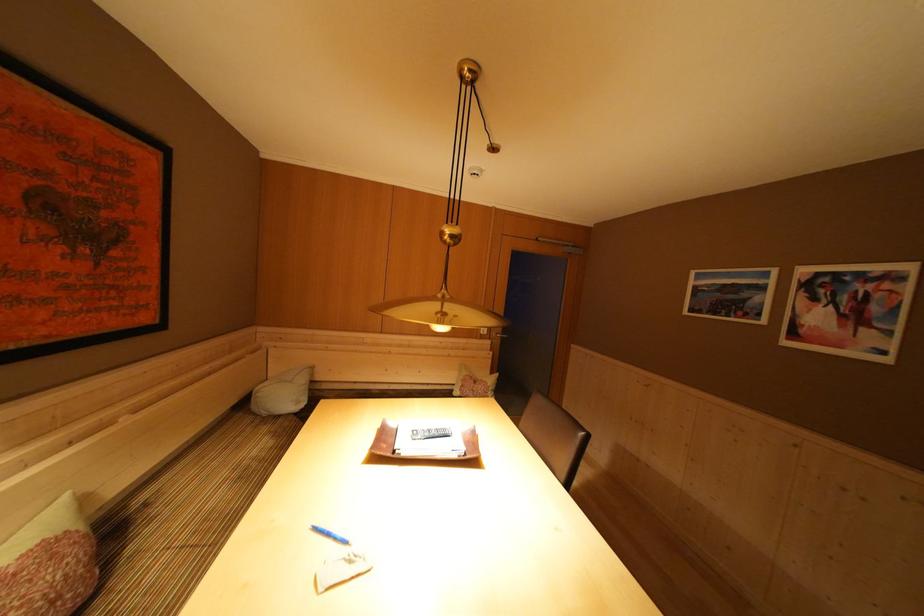
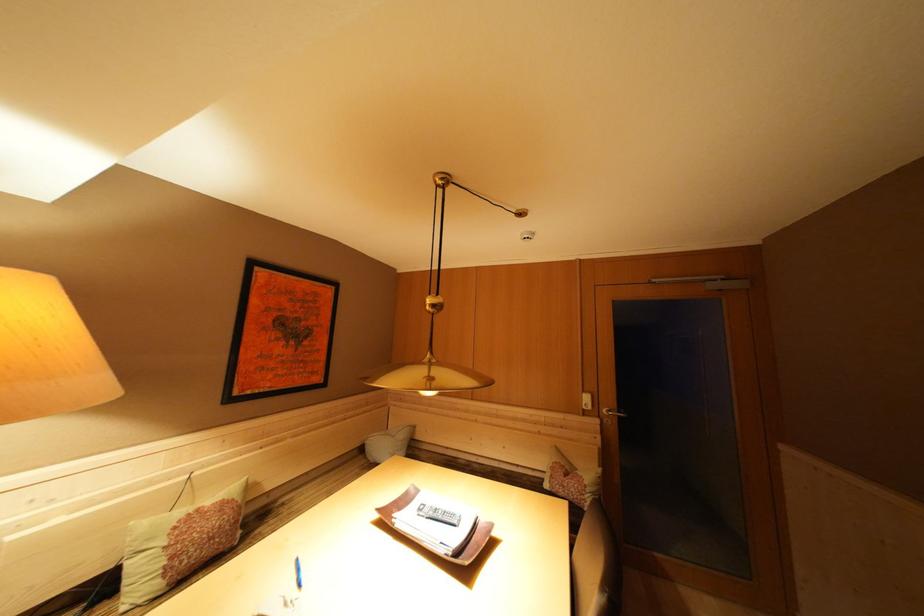
In the second image, find the point that corresponds to point 495,341 in the first image.

(602, 418)